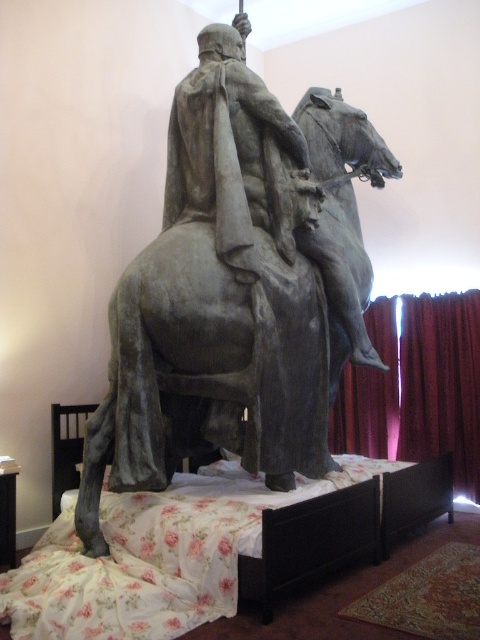
This screenshot has width=480, height=640. What do you see at coordinates (238, 288) in the screenshot?
I see `gray stone statue at center` at bounding box center [238, 288].

Can you confirm if gray stone statue at center is smaller than floral fabric bed at center?

No, gray stone statue at center is not smaller than floral fabric bed at center.

Between point (287, 275) and point (50, 560), which one is positioned in front?

Point (50, 560)

The height and width of the screenshot is (640, 480). Find the location of `gray stone statue at center`. gray stone statue at center is located at coordinates 238,288.